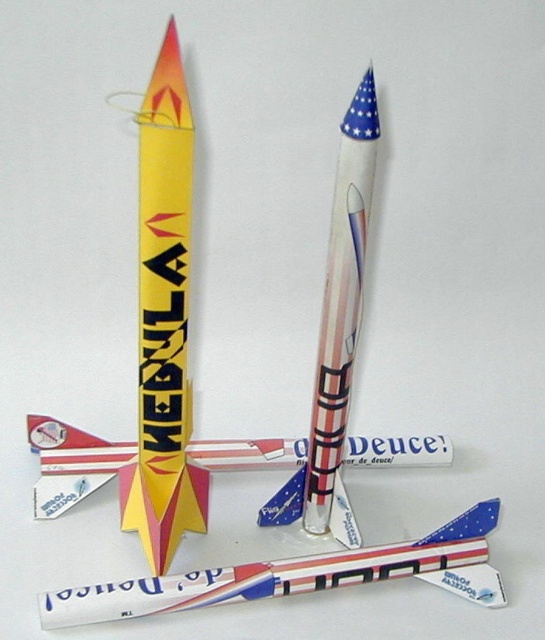
Can you confirm if american flag paper rocket at center is thinner than metallic silver airplane at center?

Correct, american flag paper rocket at center's width is less than metallic silver airplane at center's.

Which is in front, point (308, 499) or point (92, 468)?

Point (308, 499) is in front.

Between point (353, 368) and point (241, 442), which one is positioned in front?

Point (353, 368) is more forward.

Locate an element on the screen. american flag paper rocket at center is located at coordinates (341, 301).

Is point (153, 428) positioned after point (239, 460)?

No, (153, 428) is closer to viewer.

Is yellow matte rocket at center positioned in front of metallic silver airplane at center?

Yes, it is in front of metallic silver airplane at center.

Is point (143, 179) closer to camera compared to point (439, 445)?

Yes, point (143, 179) is in front of point (439, 445).

The image size is (545, 640). Identify the location of yellow matte rocket at center. (164, 321).

Between white glossy rocket at lower center and metallic silver airplane at center, which one appears on the left side from the viewer's perspective?

metallic silver airplane at center is more to the left.

Is white glossy rocket at lower center bigger than metallic silver airplane at center?

Incorrect, white glossy rocket at lower center is not larger than metallic silver airplane at center.

Which is in front, point (268, 563) or point (69, 480)?

Point (268, 563) is in front.

Identify the location of white glossy rocket at lower center. The height and width of the screenshot is (640, 545). (295, 577).